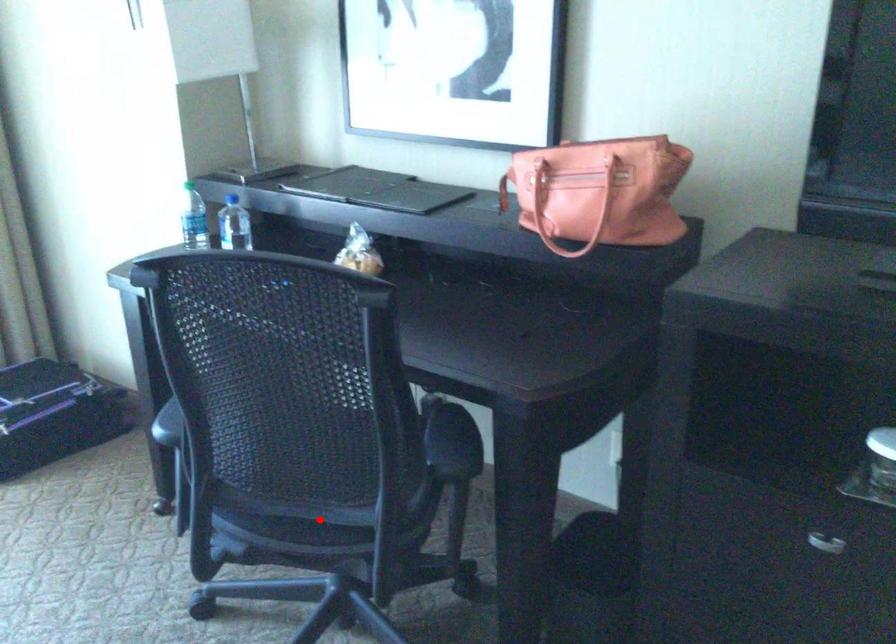
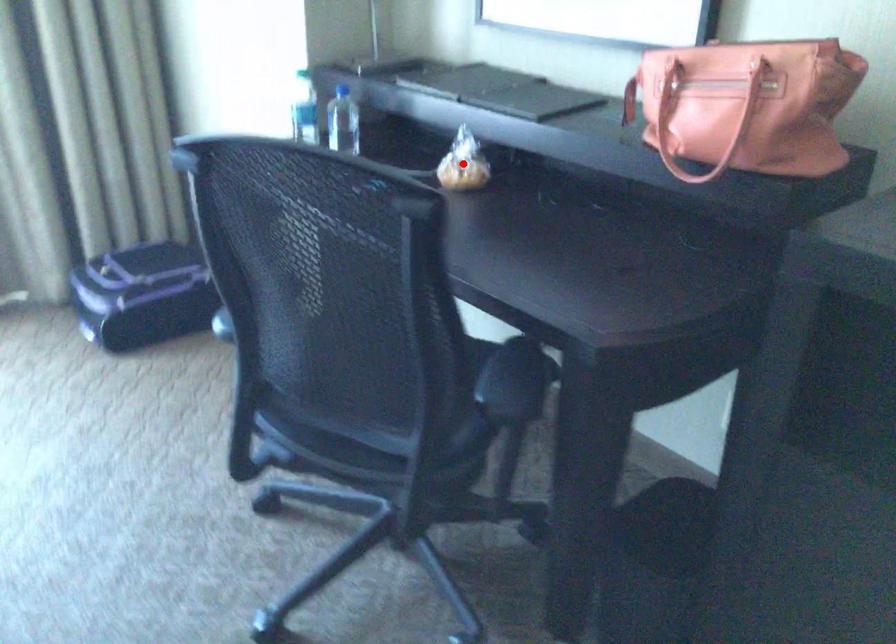
I am providing you with two images of the same scene from different viewpoints. A red point is marked on the first image and another point is marked on the second image. Is the red point in image1 aligned with the point shown in image2?

Answer: No